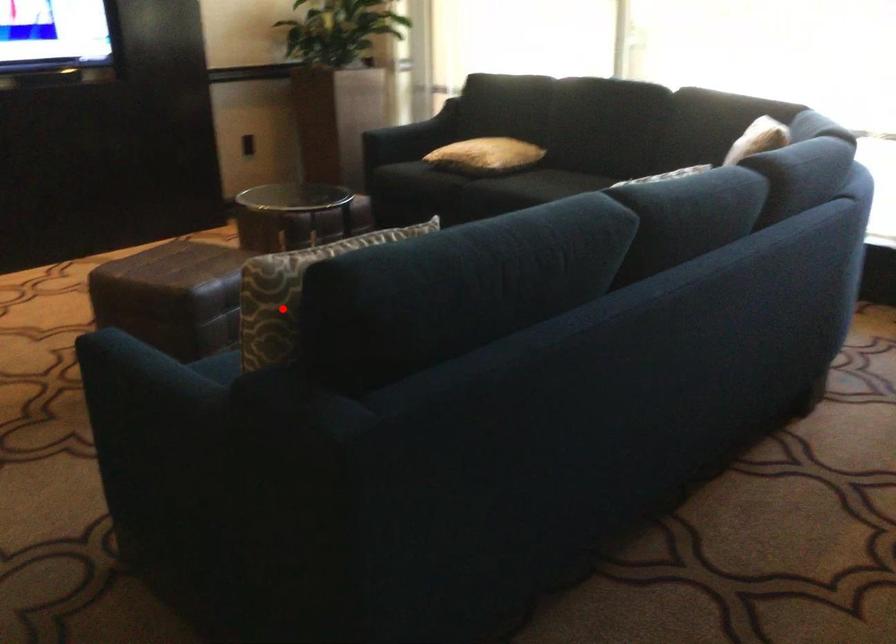
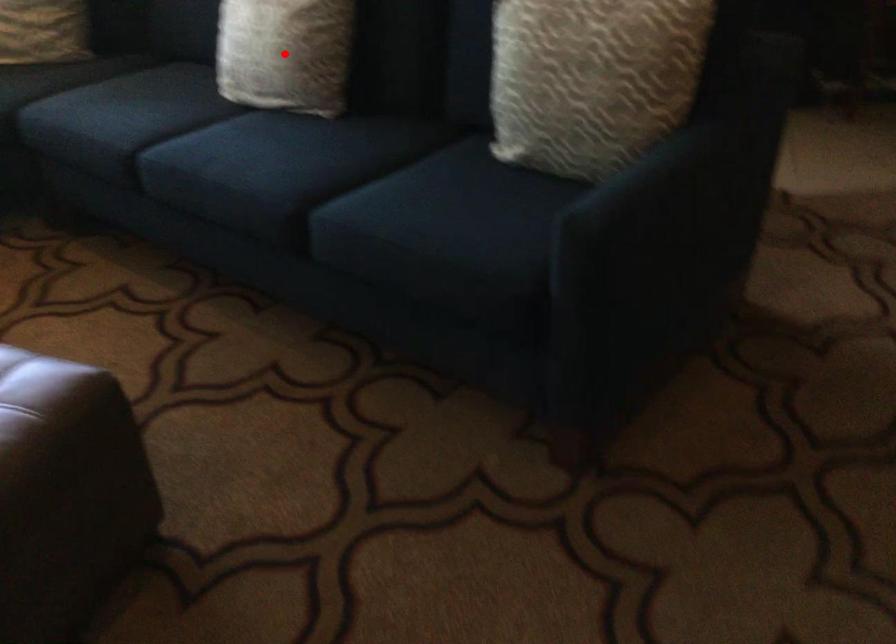
I am providing you with two images of the same scene from different viewpoints. A red point is marked on the first image and another point is marked on the second image. Is the marked point in image1 the same physical position as the marked point in image2?

No